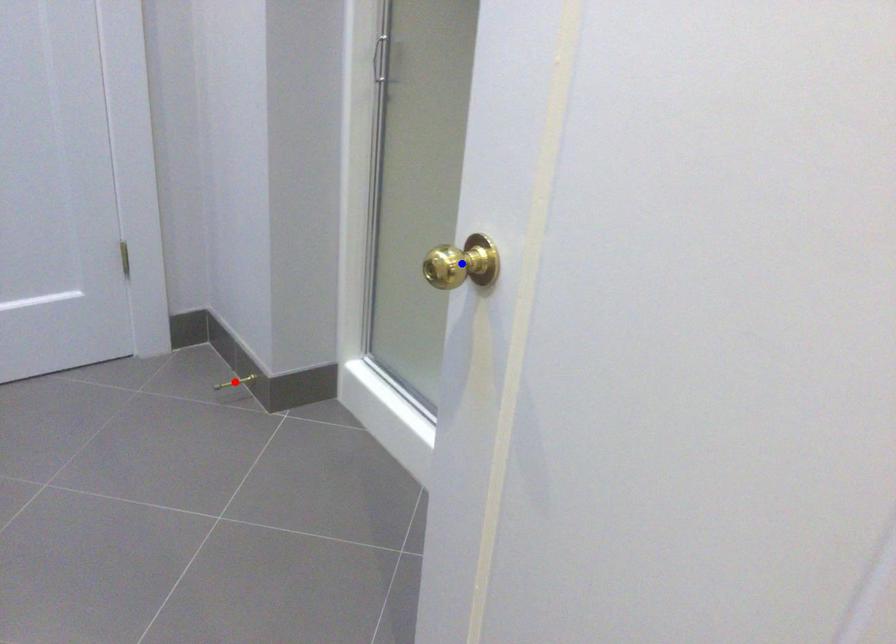
Question: Two points are marked on the image. Which point is closer to the camera?

Choices:
 (A) Blue point is closer.
 (B) Red point is closer.

Answer: (A)